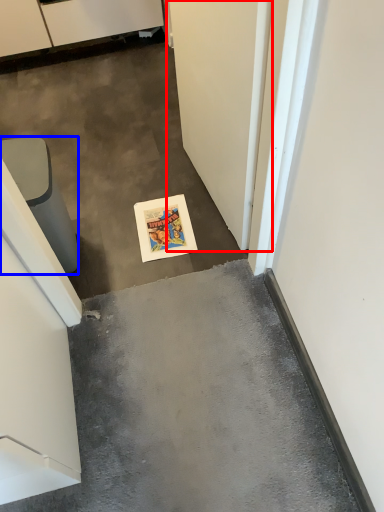
Question: Which of the following is the closest to the observer, door (highlighted by a red box) or furniture (highlighted by a blue box)?

Choices:
 (A) door
 (B) furniture

Answer: (A)